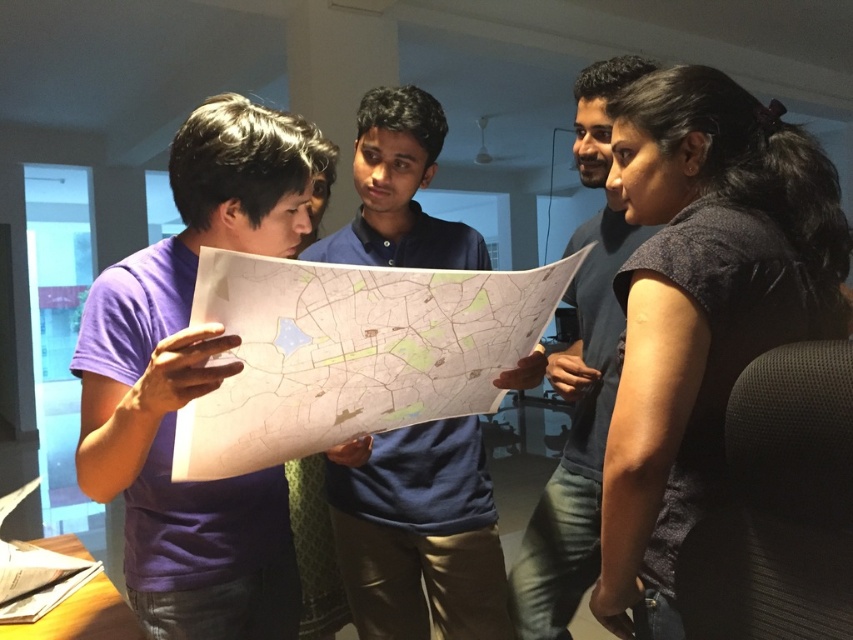
Can you confirm if white paper map at center is bigger than matte blue shirt at center?

No, white paper map at center is not bigger than matte blue shirt at center.

Who is positioned more to the left, white paper map at center or matte blue shirt at center?

From the viewer's perspective, white paper map at center appears more on the left side.

What do you see at coordinates (351, 353) in the screenshot? Image resolution: width=853 pixels, height=640 pixels. I see `white paper map at center` at bounding box center [351, 353].

You are a GUI agent. You are given a task and a screenshot of the screen. Output one action in this format:
    pyautogui.click(x=<x>, y=<y>)
    Task: Click on the white paper map at center
    
    Given the screenshot: What is the action you would take?
    pyautogui.click(x=351, y=353)

Which is more to the left, dark gray fabric shirt at upper right or blue cotton shirt at center?

From the viewer's perspective, blue cotton shirt at center appears more on the left side.

Who is more forward, (734, 333) or (434, 554)?

Point (734, 333) is in front.

What are the coordinates of `dark gray fabric shirt at upper right` in the screenshot? It's located at (701, 307).

Is dark gray fabric shirt at upper right further to the viewer compared to white paper map at center?

That is True.

Describe the element at coordinates (701, 307) in the screenshot. I see `dark gray fabric shirt at upper right` at that location.

Locate an element on the screen. The height and width of the screenshot is (640, 853). dark gray fabric shirt at upper right is located at coordinates (701, 307).